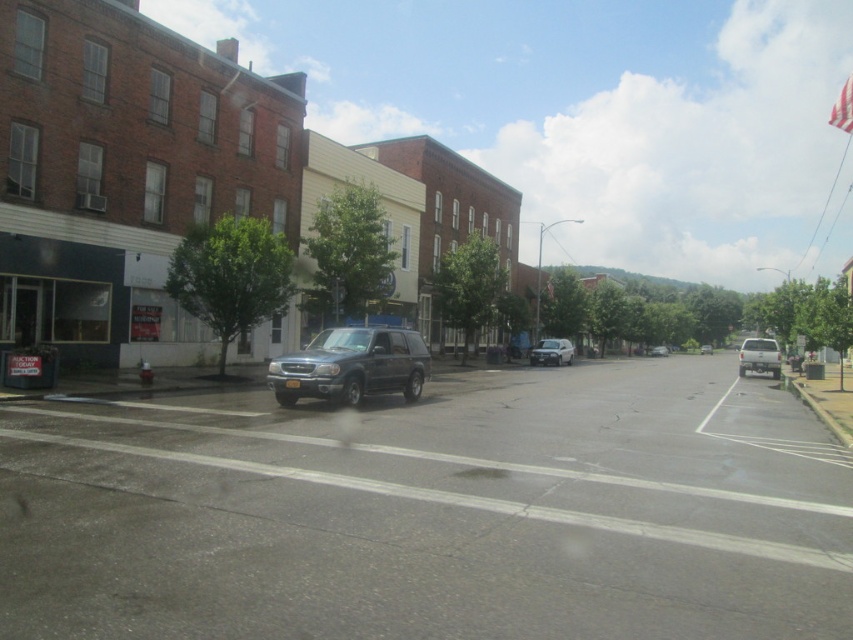
You are a delivery driver who needs to park your vehicle between the gray matte suv at center and the satin blue suv at center. Based on the scene, can you fit your 2.5 meter wide delivery van between them?

The gray matte suv at center is positioned under the satin blue suv at center, meaning they are stacked vertically. Since the vehicles are parked one above the other rather than side by side, there is no horizontal space between them for your delivery van to fit. You will need to look for another parking spot.

Consider the image. You are a delivery driver who needs to park your vehicle between the gray matte suv at center and the matte gray suv at right. Based on the scene, can you fit your truck, which is 2 meters wide, in the space between them?

The gray matte suv at center is located below the matte gray suv at right, meaning they are parked in different positions along the street. However, the exact distance between them isn not specified. Without knowing the width of the space between them, it is impossible to determine if your truck will fit.

You are standing at the point with coordinates [432,512] in the urban scene. What object is located exactly at that point?

The gray matte suv at center is located exactly at point [432,512].